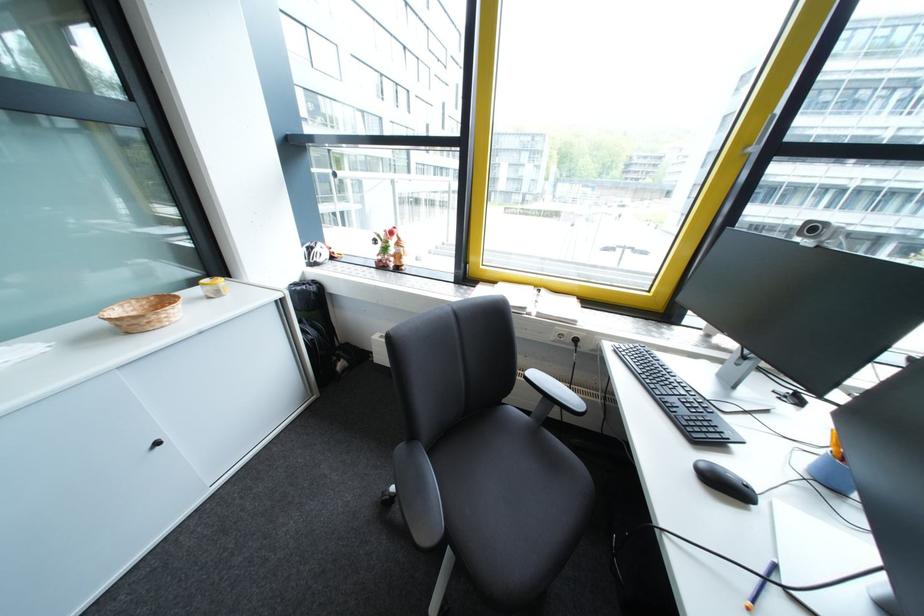
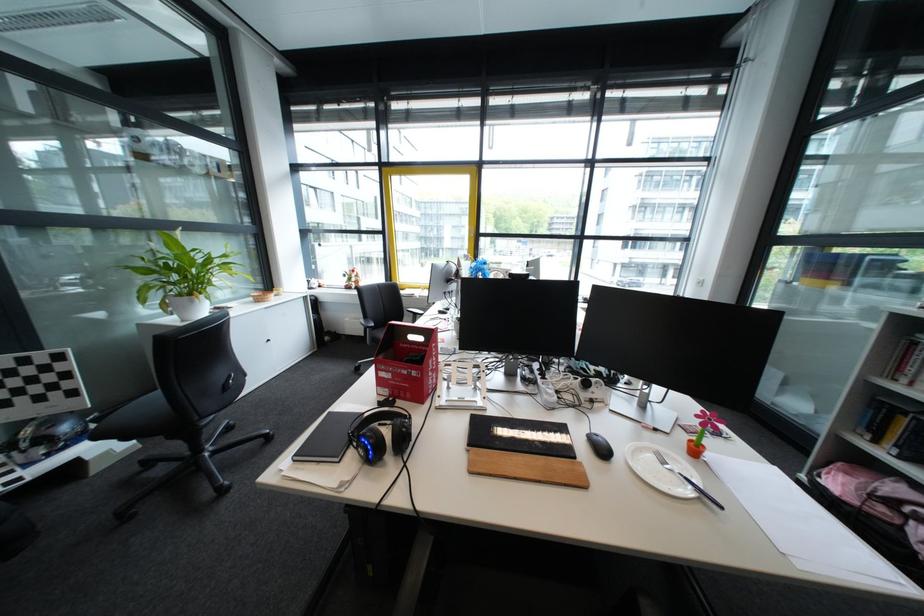
Locate, in the second image, the point that corresponds to pixel 528 195 in the first image.

(472, 251)